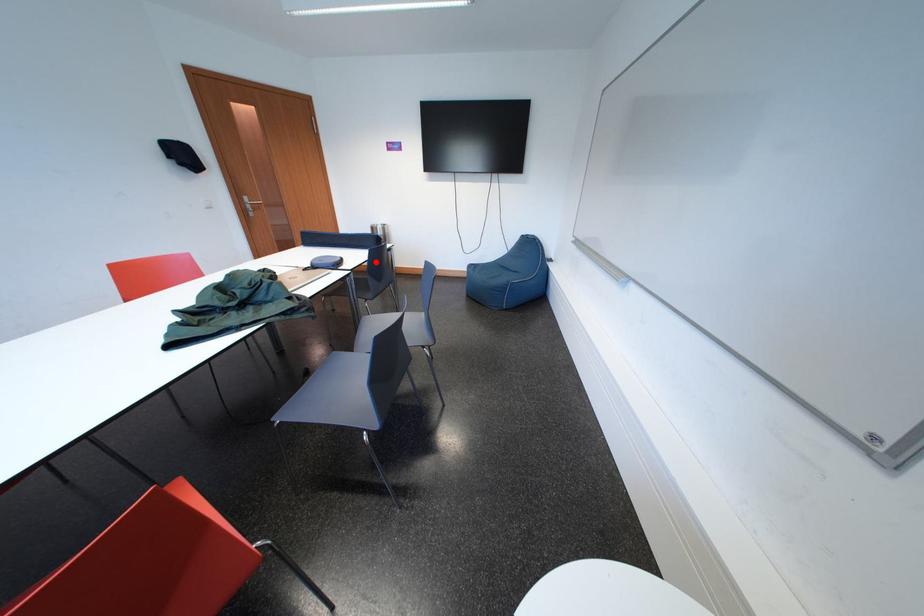
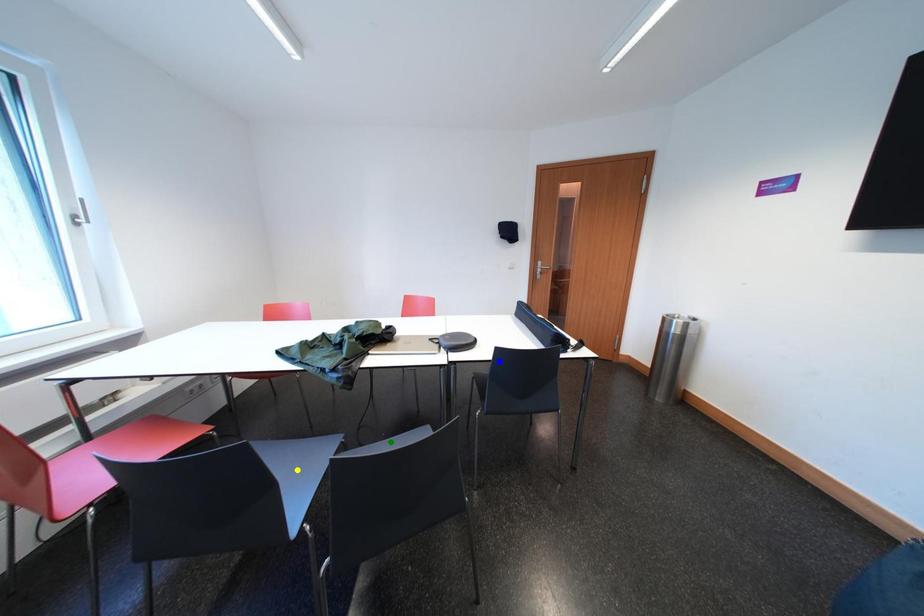
Question: I am providing you with two images of the same scene from different viewpoints. A red point is marked on the first image. You are given multiple points on the second image. Can you choose the point in image 2 that corresponds to the point in image 1?

Choices:
 (A) blue point
 (B) green point
 (C) yellow point

Answer: (A)